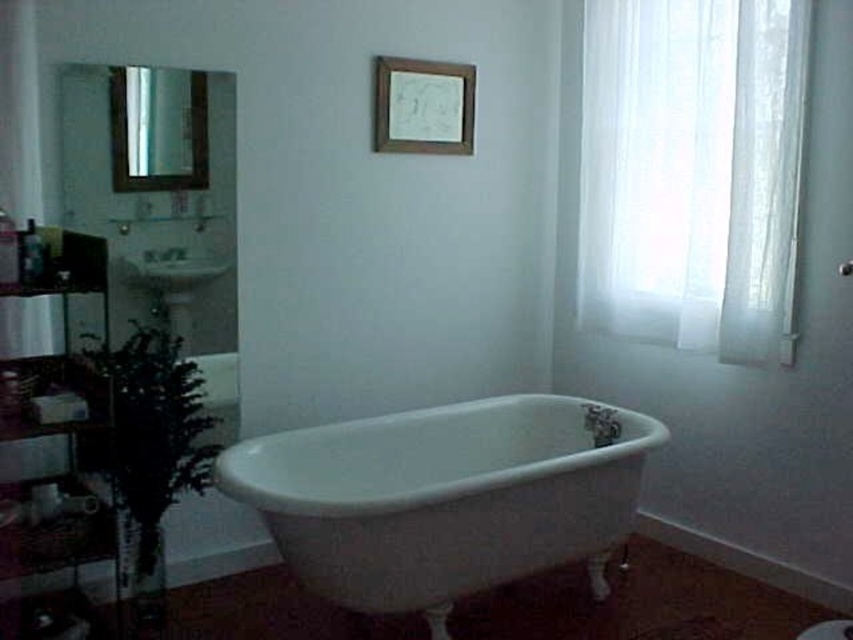
Is wooden frame at upper center wider than white glossy sink at left?

Yes.

Does point (387, 99) lie behind point (134, 264)?

Yes, point (387, 99) is behind point (134, 264).

Where is `wooden frame at upper center`? wooden frame at upper center is located at coordinates (422, 106).

Locate an element on the screen. The height and width of the screenshot is (640, 853). wooden frame at upper center is located at coordinates (422, 106).

Based on the photo, is translucent fabric curtain at right positioned at the back of white porcelain bathtub at center?

Yes, translucent fabric curtain at right is behind white porcelain bathtub at center.

Is translucent fabric curtain at right taller than white porcelain bathtub at center?

Yes.

Where is `translucent fabric curtain at right`? The width and height of the screenshot is (853, 640). translucent fabric curtain at right is located at coordinates (693, 170).

How much distance is there between white porcelain bathtub at center and white glossy sink at left?

white porcelain bathtub at center is 1.09 meters away from white glossy sink at left.

Does white porcelain bathtub at center have a greater width compared to white glossy sink at left?

Indeed, white porcelain bathtub at center has a greater width compared to white glossy sink at left.

The height and width of the screenshot is (640, 853). Identify the location of white porcelain bathtub at center. (445, 497).